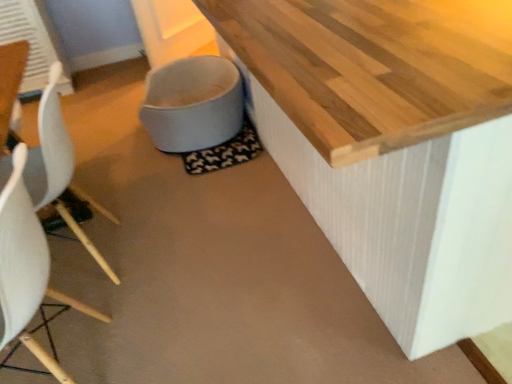
What is the approximate height of white fabric toilet bowl at lower center?

11.80 inches.

Locate an element on the screen. Image resolution: width=512 pixels, height=384 pixels. white matte chair at left, which is the first chair in front-to-back order is located at coordinates (26, 268).

Could you tell me if white fabric toilet bowl at lower center is facing white matte chair at left, which is the first chair in front-to-back order?

No, white fabric toilet bowl at lower center is not oriented towards white matte chair at left, which is the first chair in front-to-back order.

Does white fabric toilet bowl at lower center have a greater height compared to white matte chair at left, which is counted as the 2th chair, starting from the back?

Incorrect, the height of white fabric toilet bowl at lower center is not larger of that of white matte chair at left, which is counted as the 2th chair, starting from the back.

Is white fabric toilet bowl at lower center situated inside white matte chair at left, which is the first chair in front-to-back order, or outside?

The correct answer is: outside.

Which object is positioned more to the right, white fabric toilet bowl at lower center or white matte chair at left, which is counted as the 2th chair, starting from the back?

Positioned to the right is white fabric toilet bowl at lower center.

From the picture: Is white matte chair at left, which is the first chair in front-to-back order, next to white fabric toilet bowl at lower center?

There is a gap between white matte chair at left, which is the first chair in front-to-back order, and white fabric toilet bowl at lower center.

Between white matte chair at left, which is counted as the 2th chair, starting from the back, and white fabric toilet bowl at lower center, which one has smaller width?

Thinner between the two is white matte chair at left, which is counted as the 2th chair, starting from the back.

Is white matte chair at left, which is the first chair in front-to-back order, positioned with its back to white fabric toilet bowl at lower center?

No, white matte chair at left, which is the first chair in front-to-back order, is not facing the opposite direction of white fabric toilet bowl at lower center.

Which object is positioned more to the left, white matte chair at left, which is the first chair in front-to-back order, or white fabric toilet bowl at lower center?

Positioned to the left is white matte chair at left, which is the first chair in front-to-back order.

From a real-world perspective, is white fabric toilet bowl at lower center over white plastic chair at left, acting as the 2th chair starting from the front?

Incorrect, from a real-world perspective, white fabric toilet bowl at lower center is lower than white plastic chair at left, acting as the 2th chair starting from the front.

Is point (237, 103) closer to camera compared to point (91, 251)?

No, (237, 103) is further to viewer.

How different are the orientations of white fabric toilet bowl at lower center and white plastic chair at left, the 1th chair in the back-to-front sequence, in degrees?

The angle between the facing direction of white fabric toilet bowl at lower center and the facing direction of white plastic chair at left, the 1th chair in the back-to-front sequence, is 176 degrees.

Does white plastic chair at left, acting as the 2th chair starting from the front, appear on the left side of white fabric toilet bowl at lower center?

Correct, you'll find white plastic chair at left, acting as the 2th chair starting from the front, to the left of white fabric toilet bowl at lower center.

From a real-world perspective, is white plastic chair at left, the 1th chair in the back-to-front sequence, beneath white fabric toilet bowl at lower center?

Actually, white plastic chair at left, the 1th chair in the back-to-front sequence, is physically above white fabric toilet bowl at lower center in the real world.

Is white plastic chair at left, the 1th chair in the back-to-front sequence, further to camera compared to white fabric toilet bowl at lower center?

No, white plastic chair at left, the 1th chair in the back-to-front sequence, is in front of white fabric toilet bowl at lower center.

Does point (111, 271) appear closer or farther from the camera than point (163, 121)?

Point (111, 271) appears to be closer to the viewer than point (163, 121).

Is there a large distance between white matte chair at left, which is the first chair in front-to-back order, and white plastic chair at left, the 1th chair in the back-to-front sequence?

No, white matte chair at left, which is the first chair in front-to-back order, is in close proximity to white plastic chair at left, the 1th chair in the back-to-front sequence.

From the picture: Is white matte chair at left, which is counted as the 2th chair, starting from the back, closer to the viewer compared to white plastic chair at left, acting as the 2th chair starting from the front?

Yes, white matte chair at left, which is counted as the 2th chair, starting from the back, is closer to the camera.

Is white matte chair at left, which is counted as the 2th chair, starting from the back, aimed at white plastic chair at left, the 1th chair in the back-to-front sequence?

No.

Looking at their sizes, would you say white matte chair at left, which is the first chair in front-to-back order, is wider or thinner than white plastic chair at left, acting as the 2th chair starting from the front?

Clearly, white matte chair at left, which is the first chair in front-to-back order, has less width compared to white plastic chair at left, acting as the 2th chair starting from the front.

Considering the points (78, 194) and (8, 244), which point is behind, point (78, 194) or point (8, 244)?

The point (78, 194) is farther.

Is white plastic chair at left, the 1th chair in the back-to-front sequence, thinner than white matte chair at left, which is counted as the 2th chair, starting from the back?

No.

From the image's perspective, is white plastic chair at left, acting as the 2th chair starting from the front, below white matte chair at left, which is counted as the 2th chair, starting from the back?

No, from the image's perspective, white plastic chair at left, acting as the 2th chair starting from the front, is not beneath white matte chair at left, which is counted as the 2th chair, starting from the back.

From the image's perspective, count 2nd chairs downward from the white fabric toilet bowl at lower center and point to it. Please provide its 2D coordinates.

[(26, 268)]

Find the location of a particular element. toilet bowl directly beneath the white matte chair at left, which is the first chair in front-to-back order (from a real-world perspective) is located at coordinates (193, 104).

In the scene shown: Based on their spatial positions, is white fabric toilet bowl at lower center or white plastic chair at left, acting as the 2th chair starting from the front, closer to white matte chair at left, which is the first chair in front-to-back order?

Based on the image, white plastic chair at left, acting as the 2th chair starting from the front, appears to be nearer to white matte chair at left, which is the first chair in front-to-back order.

Considering their positions, is white fabric toilet bowl at lower center positioned further to white plastic chair at left, the 1th chair in the back-to-front sequence, than white matte chair at left, which is counted as the 2th chair, starting from the back?

white fabric toilet bowl at lower center is positioned further to the anchor white plastic chair at left, the 1th chair in the back-to-front sequence.

When comparing their distances from white fabric toilet bowl at lower center, does white plastic chair at left, acting as the 2th chair starting from the front, or white matte chair at left, which is the first chair in front-to-back order, seem closer?

white plastic chair at left, acting as the 2th chair starting from the front, is positioned closer to the anchor white fabric toilet bowl at lower center.

From the image, which object appears to be farther from white plastic chair at left, acting as the 2th chair starting from the front, white matte chair at left, which is the first chair in front-to-back order, or white fabric toilet bowl at lower center?

white fabric toilet bowl at lower center lies further to white plastic chair at left, acting as the 2th chair starting from the front, than the other object.

Looking at the image, which one is located closer to white matte chair at left, which is the first chair in front-to-back order, white plastic chair at left, acting as the 2th chair starting from the front, or white fabric toilet bowl at lower center?

white plastic chair at left, acting as the 2th chair starting from the front, lies closer to white matte chair at left, which is the first chair in front-to-back order, than the other object.

When comparing their distances from white fabric toilet bowl at lower center, does white matte chair at left, which is the first chair in front-to-back order, or white plastic chair at left, acting as the 2th chair starting from the front, seem further?

white matte chair at left, which is the first chair in front-to-back order, is further to white fabric toilet bowl at lower center.

Find the location of a particular element. This screenshot has width=512, height=384. chair located between white matte chair at left, which is counted as the 2th chair, starting from the back, and white fabric toilet bowl at lower center in the depth direction is located at coordinates (56, 164).